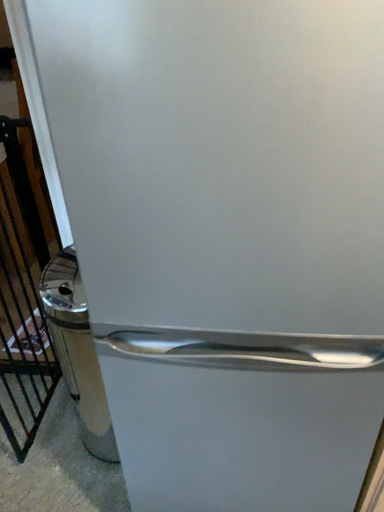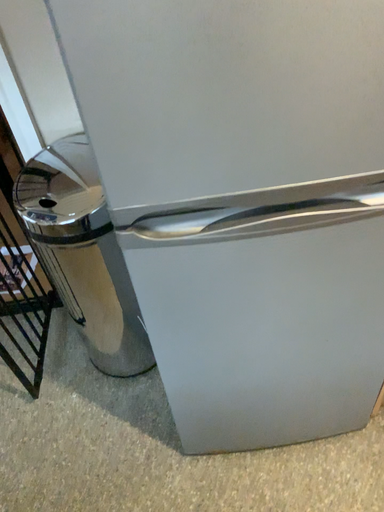
Question: Which way did the camera rotate in the video?

Choices:
 (A) rotated right
 (B) rotated left

Answer: (A)